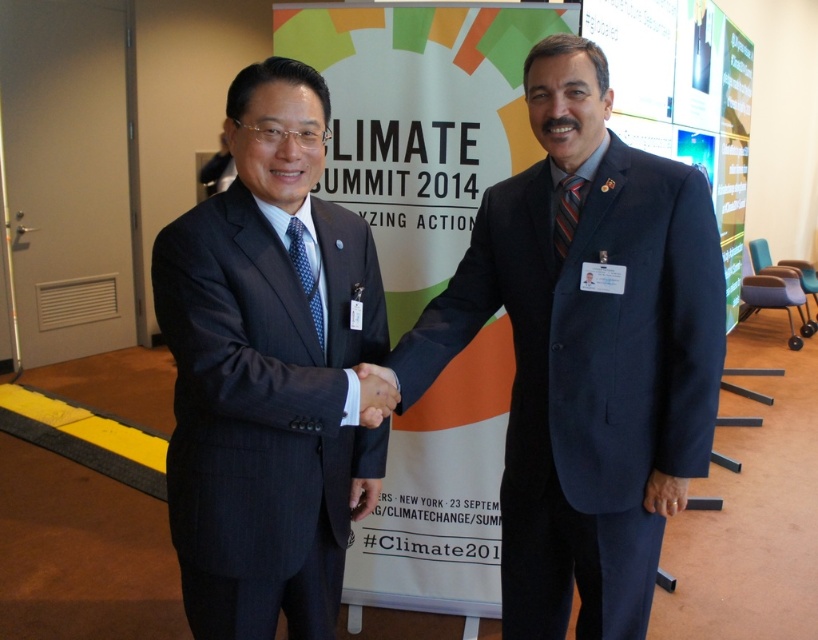
Question: Among these objects, which one is farthest from the camera?

Choices:
 (A) striped silk tie at right
 (B) dark blue suit at center
 (C) blue dotted tie at center
 (D) dark gray suit at center

Answer: (A)

Question: Is black smooth hand at center bigger than striped silk tie at right?

Choices:
 (A) yes
 (B) no

Answer: (A)

Question: Where is dark blue suit at center located in relation to blue dotted tie at center in the image?

Choices:
 (A) right
 (B) left

Answer: (A)

Question: Considering the real-world distances, which object is farthest from the dark blue suit at center?

Choices:
 (A) blue dotted tie at center
 (B) striped silk tie at right
 (C) black smooth hand at center
 (D) dark gray suit at center

Answer: (A)

Question: In this image, where is black smooth hand at center located relative to striped silk tie at right?

Choices:
 (A) right
 (B) left

Answer: (B)

Question: Which point is farther from the camera taking this photo?

Choices:
 (A) (371, 400)
 (B) (565, 240)

Answer: (B)